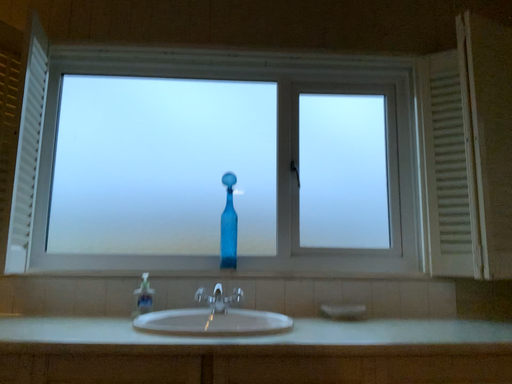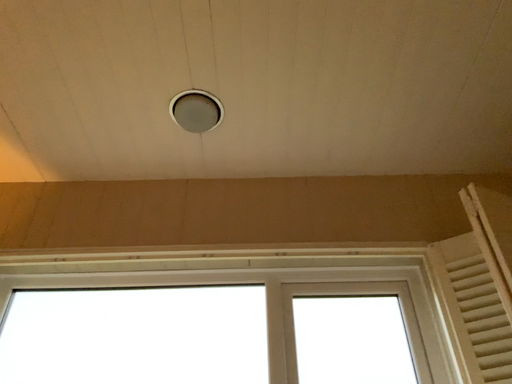
Question: Which way did the camera rotate in the video?

Choices:
 (A) rotated downward
 (B) rotated upward

Answer: (B)